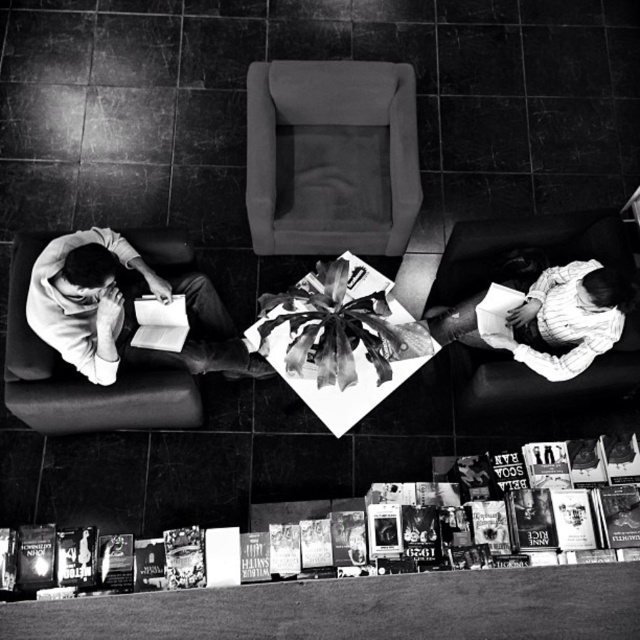
What do you see at coordinates (332, 156) in the screenshot? The height and width of the screenshot is (640, 640). I see `soft gray fabric chair at center` at bounding box center [332, 156].

Locate an element on the screen. This screenshot has width=640, height=640. soft gray fabric chair at center is located at coordinates (x=332, y=156).

Locate an element on the screen. soft gray fabric chair at center is located at coordinates tap(332, 156).

Which of these two, smooth white shirt at left or soft fabric couch at lower right, stands taller?

smooth white shirt at left

What do you see at coordinates (124, 310) in the screenshot?
I see `smooth white shirt at left` at bounding box center [124, 310].

Is point (92, 252) positioned in front of point (595, 376)?

Yes, point (92, 252) is closer to viewer.

Identify the location of smooth white shirt at left. This screenshot has width=640, height=640. (124, 310).

Is soft gray fabric chair at center behind smooth white shirt at left?

Yes, soft gray fabric chair at center is behind smooth white shirt at left.

Which is more to the right, soft gray fabric chair at center or smooth white shirt at left?

soft gray fabric chair at center

Identify the location of soft gray fabric chair at center. (332, 156).

Where is `soft gray fabric chair at center`? The width and height of the screenshot is (640, 640). soft gray fabric chair at center is located at coordinates (332, 156).